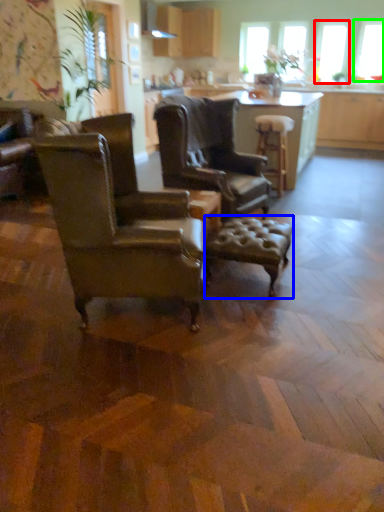
Question: Considering the real-world distances, which object is farthest from window screen (highlighted by a red box)? stool (highlighted by a blue box) or window screen (highlighted by a green box)?

Choices:
 (A) stool
 (B) window screen

Answer: (A)